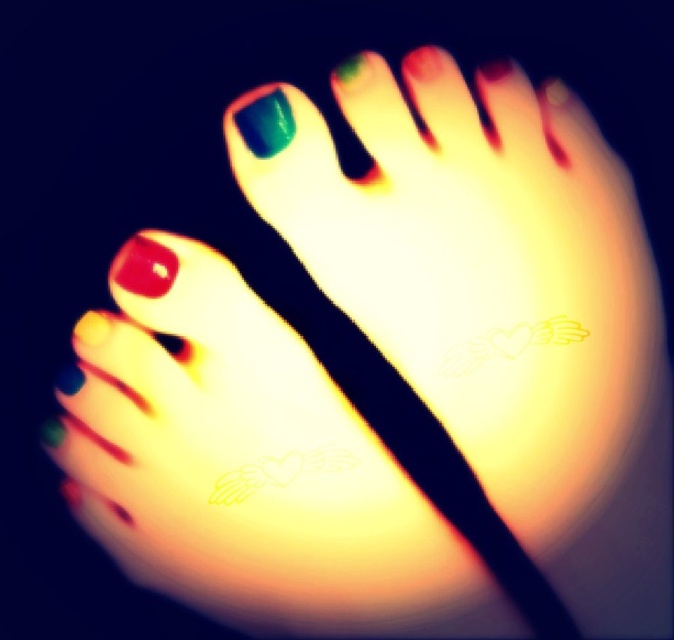
You are a nail artist observing the two feet in the image. The client wants to know if the matte red nail at center is positioned to the left or right of the green glossy nail at upper center. Can you clarify this for them?

The matte red nail at center is to the left of the green glossy nail at upper center.

Looking at this image, you are a nail artist trying to replicate the design from the image. You need to place a matte red nail at center. Where should you position it relative to the other nails?

The matte red nail at center should be positioned at point 0.417 on the x axis and 0.214 on the y axis.